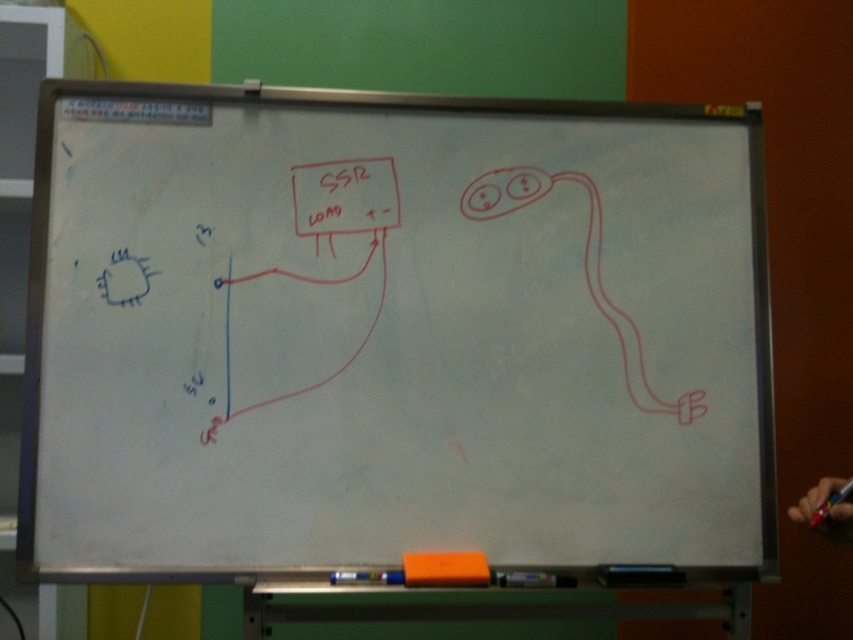
Is point (299, 188) farther from camera compared to point (608, 584)?

Yes, it is.

Is white matte board at center to the left of black matte pen at lower center from the viewer's perspective?

Yes, white matte board at center is to the left of black matte pen at lower center.

What do you see at coordinates (392, 333) in the screenshot? I see `white matte board at center` at bounding box center [392, 333].

The image size is (853, 640). Identify the location of white matte board at center. (392, 333).